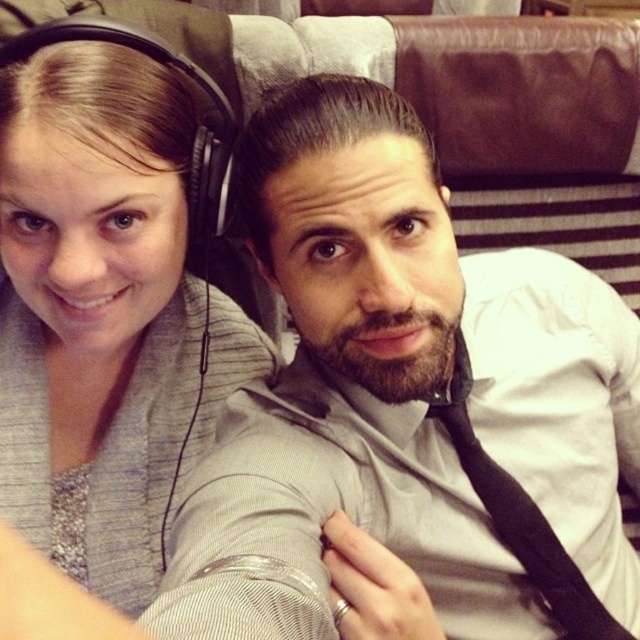
You are a photographer setting up a shoot in the scene described. You need to place a small prop between the matte white shirt at center and the gray fabric at upper left. Based on their positions, where should you place the prop?

The matte white shirt at center is below the gray fabric at upper left, so you should place the prop between them by positioning it just above the matte white shirt at center and below the gray fabric at upper left.

You are a photographer trying to capture a clear shot of the matte white shirt at center in this scene. Based on its position, would you adjust your camera focus to a closer or farther distance compared to the default focus point set at the center of the image?

The matte white shirt at center is located at point (403,396), which is slightly offset from the exact center. To capture it clearly, adjust the camera focus closer to that coordinate rather than the default center point.